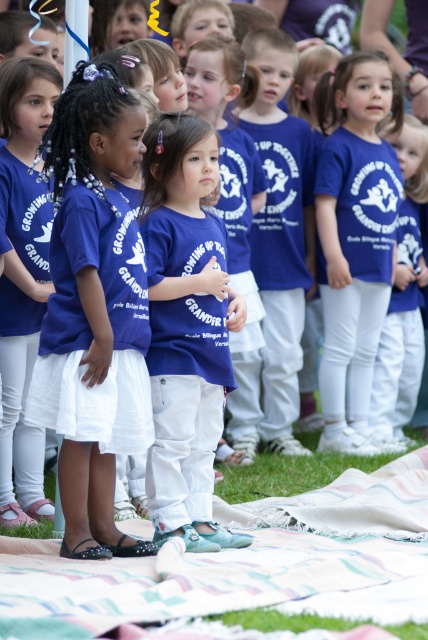
You are a photographer trying to capture a photo of the children. You notice two points in the image labeled as point 1 at position (44, 636) and point 2 at position (214, 344). Which point is closer to you?

Point 1 at position (44, 636) is closer to the viewer than point 2 at position (214, 344).